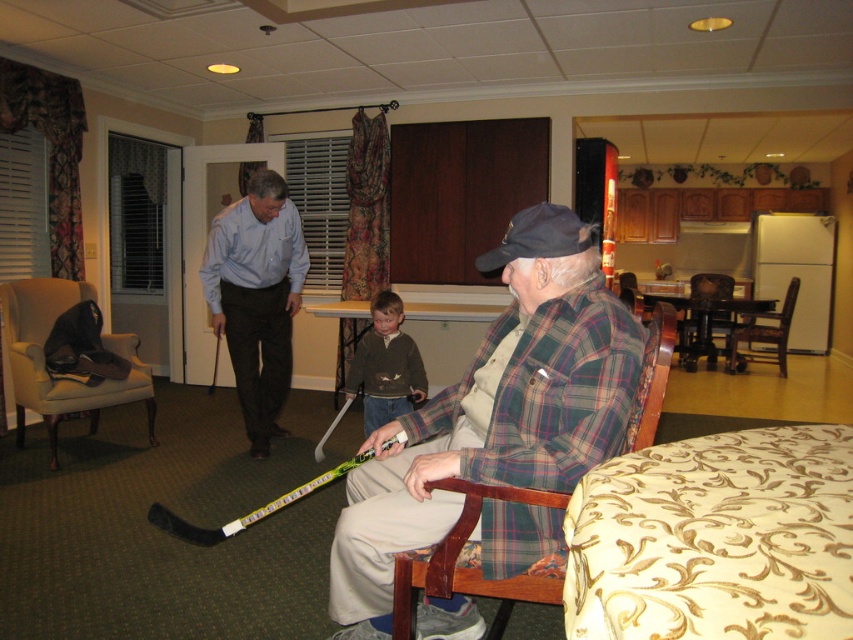
You are a visitor in the room and want to sit down. You see the plaid flannel shirt at center and the beige fabric wingback chair at left. Which object is closer to your current position if you are standing in the center of the room?

The plaid flannel shirt at center is closer to your current position since it is located at the center of the room, while the beige fabric wingback chair at left is positioned to the left side.